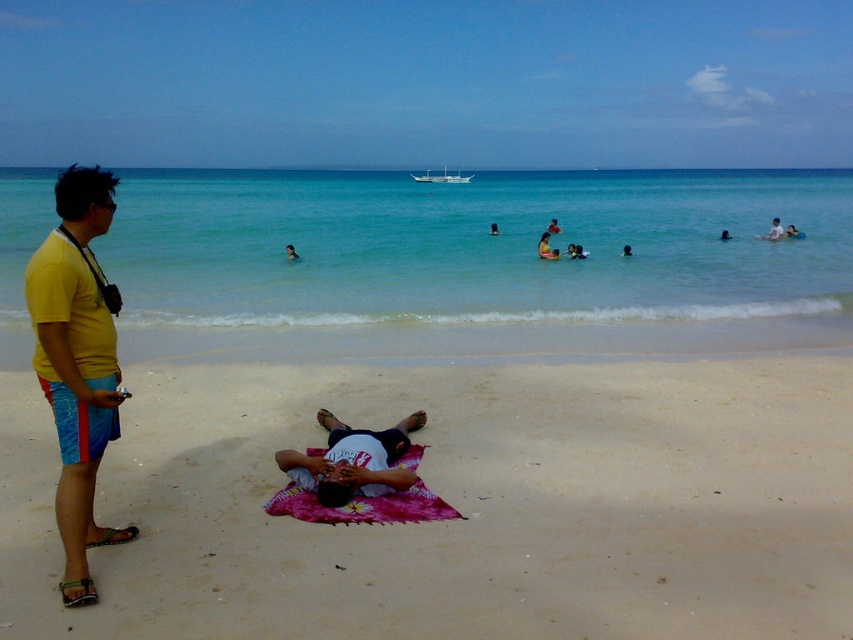
Is yellow fabric shorts at left smaller than pink fabric blanket at center?

No, yellow fabric shorts at left is not smaller than pink fabric blanket at center.

Does yellow fabric shorts at left have a larger size compared to pink fabric blanket at center?

Correct, yellow fabric shorts at left is larger in size than pink fabric blanket at center.

Who is more distant from viewer, (96, 202) or (305, 496)?

The point (305, 496) is behind.

The width and height of the screenshot is (853, 640). I want to click on yellow fabric shorts at left, so pyautogui.click(x=77, y=362).

Between clear blue water at center and white matte shirt at center, which one is positioned higher?

clear blue water at center

Does point (463, 227) come closer to viewer compared to point (401, 433)?

No, (463, 227) is further to viewer.

Where is `clear blue water at center`? The image size is (853, 640). clear blue water at center is located at coordinates (474, 248).

Does white matte shirt at center lie in front of pink fabric blanket at center?

No, white matte shirt at center is further to the viewer.

Can you confirm if white matte shirt at center is positioned to the left of pink fabric blanket at center?

Correct, you'll find white matte shirt at center to the left of pink fabric blanket at center.

Between point (323, 420) and point (311, 456), which one is positioned in front?

Point (311, 456) is more forward.

The image size is (853, 640). Identify the location of white matte shirt at center. (352, 460).